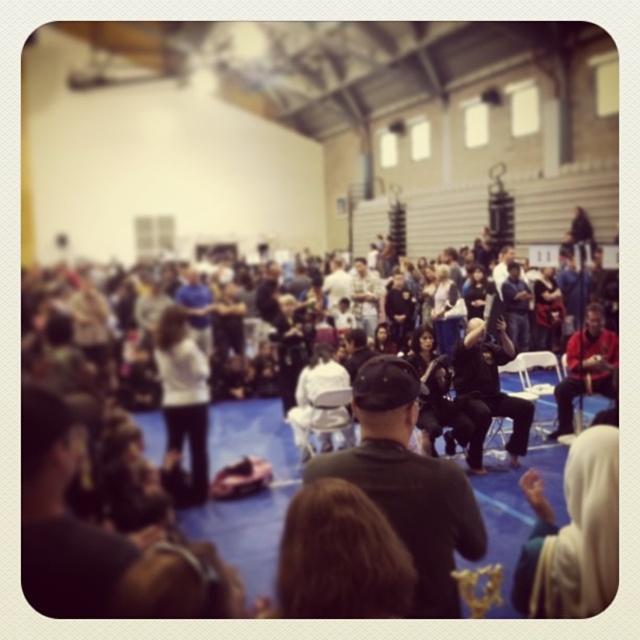
You are a photographer positioned at the back of the hall. You need to capture a photo of both the black leather jacket at center and the white matte shirt at center in the same frame. Given your camera has a maximum focus range of 15 feet, will you be able to include both subjects in focus without moving closer?

The distance between the black leather jacket at center and the white matte shirt at center is 14.80 feet, which is within the camera maximum focus range of 15 feet. Therefore, you can capture both subjects in focus without moving closer.

You are a photographer at the martial arts event. You want to capture a photo of the matte black cap at lower left. Where exactly should you position your camera to ensure the cap is in the frame?

Position your camera at point (61, 518) to capture the matte black cap at lower left in the frame.

You are a photographer at the event and need to capture a clear photo of both the black leather jacket at center and the white matte shirt at center. Since you want both subjects to be fully visible in the frame, which one should you adjust your camera angle to focus on first, considering their height difference?

The black leather jacket at center is shorter than the white matte shirt at center. To ensure both are fully visible, focus on the taller white matte shirt at center first, then adjust the angle slightly downward to include the shorter black leather jacket at center in the frame.